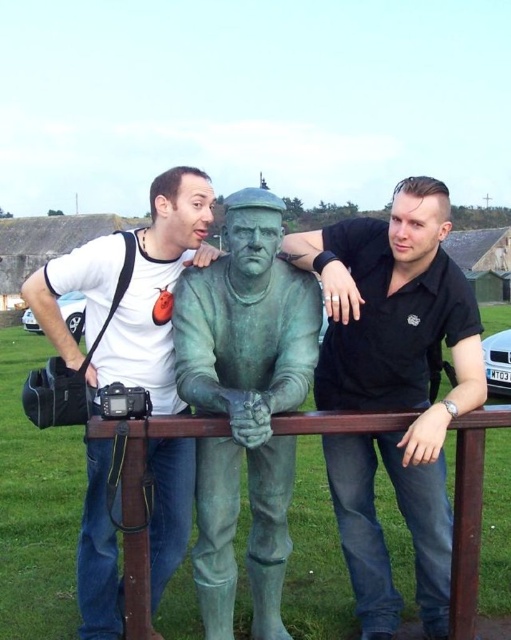
You are standing at the position where the viewer is and want to take a photo of the green patina statue at center. The camera you have has a maximum focus range of 7 meters. Will you be able to capture the statue clearly?

The green patina statue at center and viewer are 7.15 meters apart from each other. Since the camera can only focus up to 7 meters, you will not be able to capture the statue clearly as it is beyond the camera range.